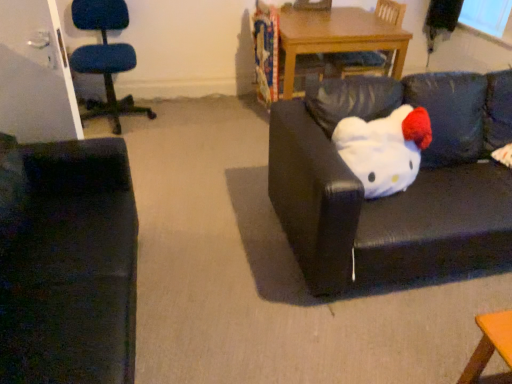
Question: In the image, is wooden table at center positioned in front of or behind blue fabric chair at left, arranged as the 2th chair when viewed from the right?

Choices:
 (A) behind
 (B) front

Answer: (A)

Question: Is point (357, 26) positioned closer to the camera than point (88, 61)?

Choices:
 (A) farther
 (B) closer

Answer: (A)

Question: Considering the real-world distances, which object is farthest from the black leather couch at center, arranged as the 2th studio couch when viewed from the left?

Choices:
 (A) velvet dark green couch at left, which appears as the 2th studio couch when viewed from the right
 (B) wooden table at center
 (C) wooden chair at upper center, which appears as the second chair when viewed from the left
 (D) white plush toy at right
 (E) blue fabric chair at left, arranged as the 2th chair when viewed from the right

Answer: (E)

Question: Which object is the farthest from the blue fabric chair at left, positioned as the first chair in left-to-right order?

Choices:
 (A) wooden chair at upper center, the first chair from the right
 (B) black leather couch at center, arranged as the 2th studio couch when viewed from the left
 (C) wooden table at center
 (D) velvet dark green couch at left, which appears as the 2th studio couch when viewed from the right
 (E) white plush toy at right

Answer: (E)